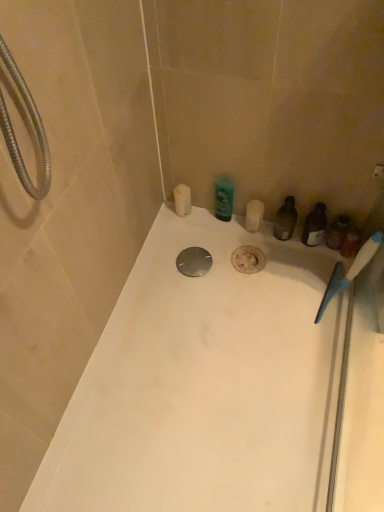
Identify the location of free region on the left part of translucent plastic container at right, the 3th toiletry positioned from the left. (275, 264).